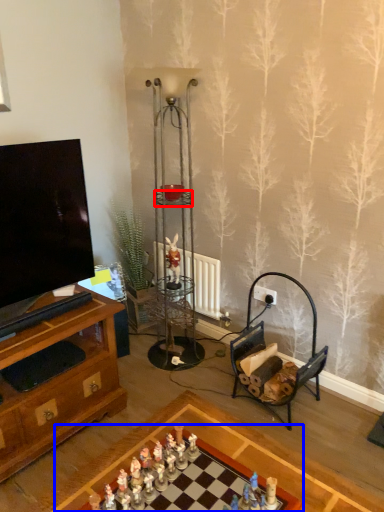
Question: Which object is closer to the camera taking this photo, shelf (highlighted by a red box) or table (highlighted by a blue box)?

Choices:
 (A) shelf
 (B) table

Answer: (B)